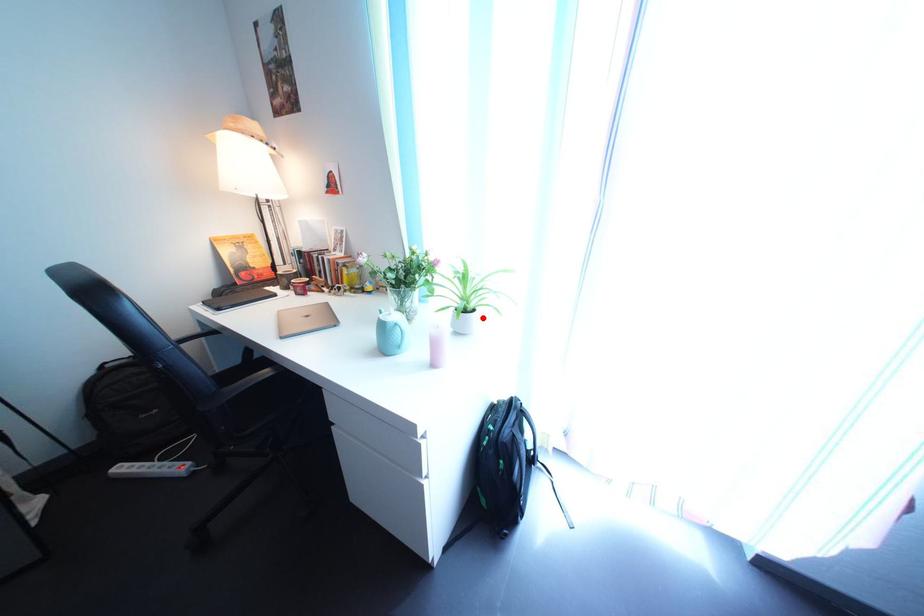
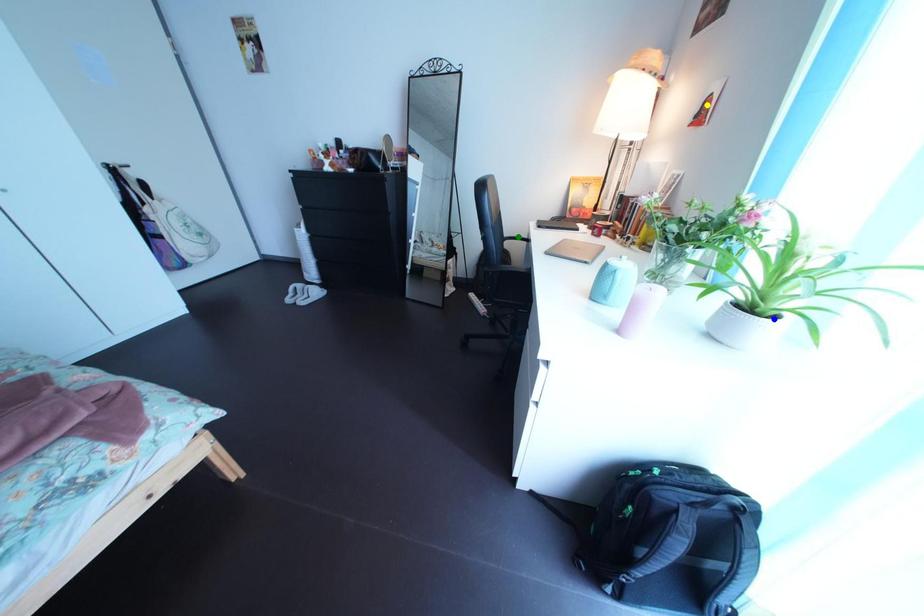
Question: I am providing you with two images of the same scene from different viewpoints. A red point is marked on the first image. You are given multiple points on the second image. In image 2, which mark is for the same physical point as the one in image 1?

Choices:
 (A) yellow point
 (B) blue point
 (C) green point

Answer: (B)